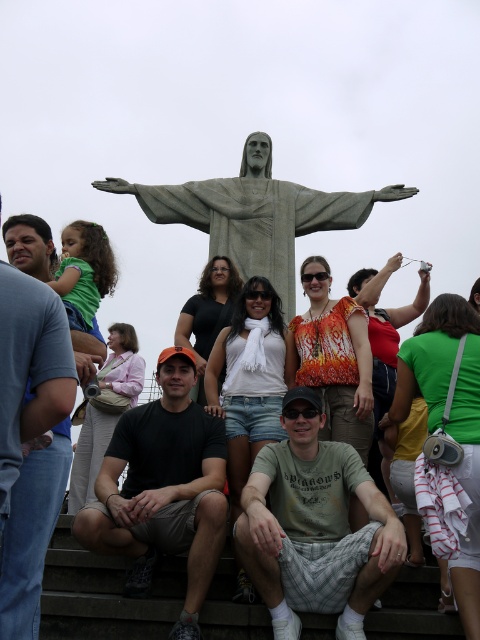
Question: Is printed cotton blouse at center to the left of orange printed blouse at center from the viewer's perspective?

Choices:
 (A) no
 (B) yes

Answer: (B)

Question: Where is gray stone statue at center located in relation to black fabric shirt at center in the image?

Choices:
 (A) left
 (B) right

Answer: (B)

Question: Considering the real-world distances, which object is farthest from the orange printed blouse at center?

Choices:
 (A) printed cotton blouse at center
 (B) black fabric shirt at center

Answer: (B)

Question: Which point is closer to the camera taking this photo?

Choices:
 (A) (395, 260)
 (B) (432, 417)
 (C) (242, 365)
 (D) (99, 582)

Answer: (D)

Question: Can you confirm if pink fabric purse at center is smaller than black fabric shirt at center?

Choices:
 (A) no
 (B) yes

Answer: (A)

Question: Which is farther from the pink fabric purse at center?

Choices:
 (A) orange printed blouse at center
 (B) printed cotton blouse at center
 (C) green fabric bag at right
 (D) dark gray stone stairs at center

Answer: (C)